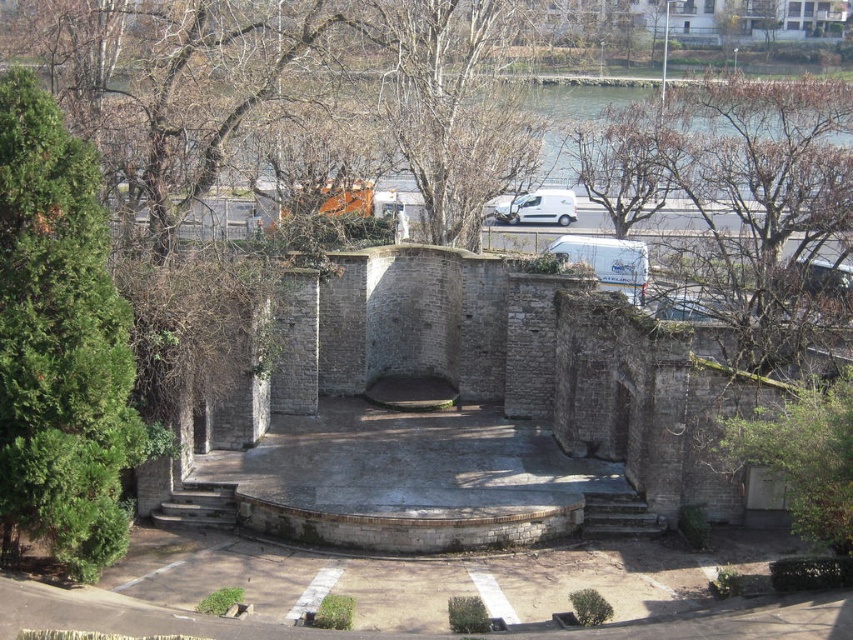
Is stone amphitheater at center thinner than white matte van at center?

No, stone amphitheater at center is not thinner than white matte van at center.

Based on the photo, which is more to the left, stone amphitheater at center or white matte van at center?

From the viewer's perspective, stone amphitheater at center appears more on the left side.

Find the location of a particular element. This screenshot has width=853, height=640. stone amphitheater at center is located at coordinates (527, 368).

Who is more forward, [33,138] or [374,10]?

Point [33,138] is more forward.

Can you confirm if green leafy tree at left is positioned to the left of bare wood tree at upper center?

Correct, you'll find green leafy tree at left to the left of bare wood tree at upper center.

Locate an element on the screen. green leafy tree at left is located at coordinates (59, 344).

Who is higher up, green leafy tree at left or white matte van at center?

Positioned higher is white matte van at center.

What do you see at coordinates (59, 344) in the screenshot? The width and height of the screenshot is (853, 640). I see `green leafy tree at left` at bounding box center [59, 344].

This screenshot has width=853, height=640. Find the location of `green leafy tree at left`. green leafy tree at left is located at coordinates (59, 344).